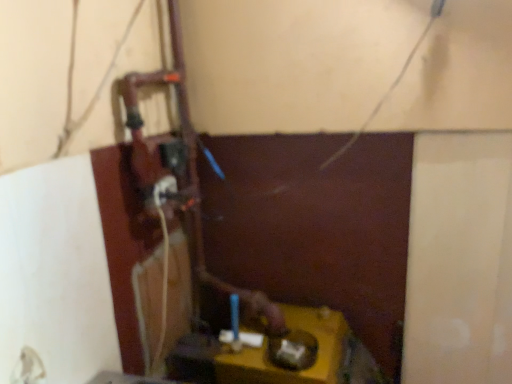
Question: Is white plastic power plugs and sockets at center-left at the right side of yellow matte table at lower center?

Choices:
 (A) no
 (B) yes

Answer: (A)

Question: Considering the relative sizes of white plastic power plugs and sockets at center-left and yellow matte table at lower center in the image provided, is white plastic power plugs and sockets at center-left taller than yellow matte table at lower center?

Choices:
 (A) yes
 (B) no

Answer: (B)

Question: Are white plastic power plugs and sockets at center-left and yellow matte table at lower center located far from each other?

Choices:
 (A) yes
 (B) no

Answer: (B)

Question: Does white plastic power plugs and sockets at center-left have a larger size compared to yellow matte table at lower center?

Choices:
 (A) no
 (B) yes

Answer: (A)

Question: Would you say white plastic power plugs and sockets at center-left is outside yellow matte table at lower center?

Choices:
 (A) no
 (B) yes

Answer: (B)

Question: Is white plastic power plugs and sockets at center-left thinner than yellow matte table at lower center?

Choices:
 (A) yes
 (B) no

Answer: (A)

Question: Does yellow matte table at lower center have a smaller size compared to white plastic power plugs and sockets at center-left?

Choices:
 (A) yes
 (B) no

Answer: (B)

Question: From a real-world perspective, is yellow matte table at lower center under white plastic power plugs and sockets at center-left?

Choices:
 (A) yes
 (B) no

Answer: (A)

Question: Considering the relative sizes of yellow matte table at lower center and white plastic power plugs and sockets at center-left in the image provided, is yellow matte table at lower center wider than white plastic power plugs and sockets at center-left?

Choices:
 (A) no
 (B) yes

Answer: (B)

Question: Does yellow matte table at lower center have a larger size compared to white plastic power plugs and sockets at center-left?

Choices:
 (A) yes
 (B) no

Answer: (A)

Question: Does yellow matte table at lower center touch white plastic power plugs and sockets at center-left?

Choices:
 (A) yes
 (B) no

Answer: (B)

Question: Is yellow matte table at lower center located outside white plastic power plugs and sockets at center-left?

Choices:
 (A) no
 (B) yes

Answer: (B)

Question: From a real-world perspective, is yellow matte table at lower center physically located above or below white plastic power plugs and sockets at center-left?

Choices:
 (A) above
 (B) below

Answer: (B)